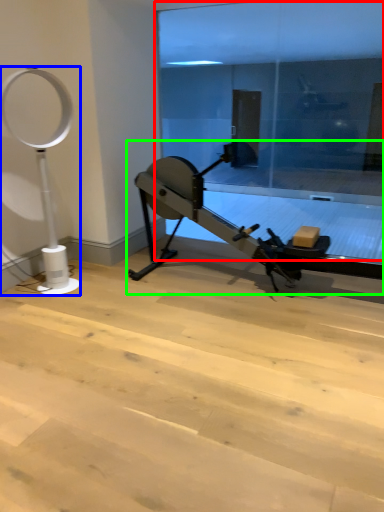
Question: Considering the real-world distances, which object is farthest from glass door (highlighted by a red box)? basketball hoop (highlighted by a blue box) or stationary bicycle (highlighted by a green box)?

Choices:
 (A) basketball hoop
 (B) stationary bicycle

Answer: (A)